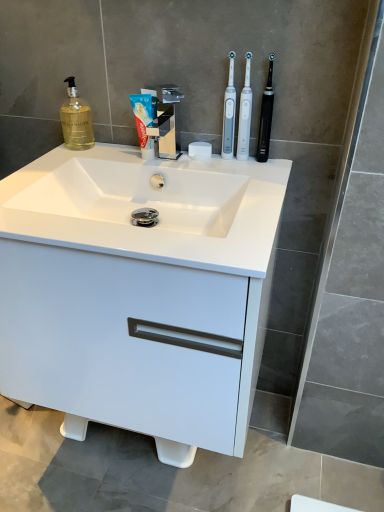
This screenshot has height=512, width=384. Identify the location of free space in front of black rubberized toothbrush at upper right, which ranks as the third toothbrush in left-to-right order. (265, 179).